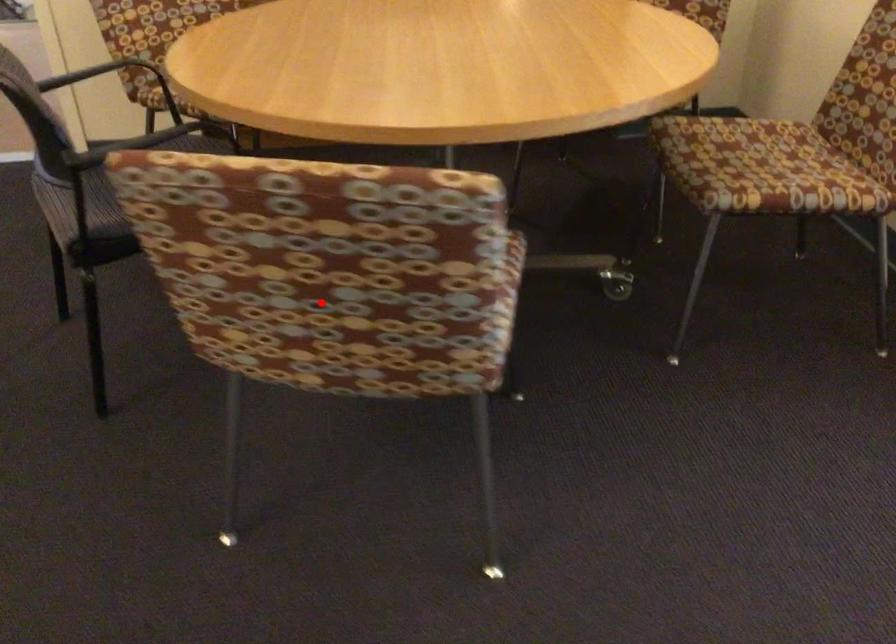
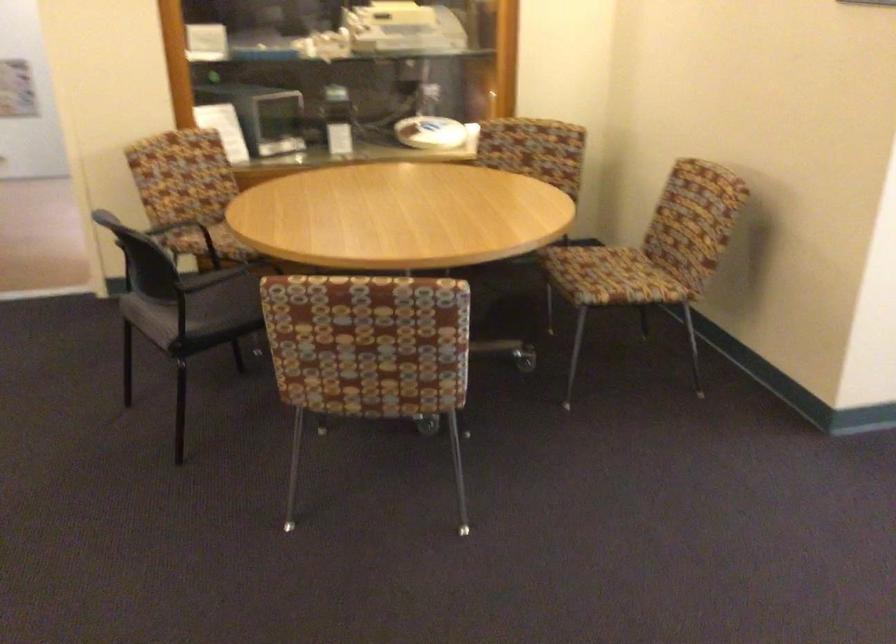
Where in the second image is the point corresponding to the highlighted location from the first image?

(368, 353)